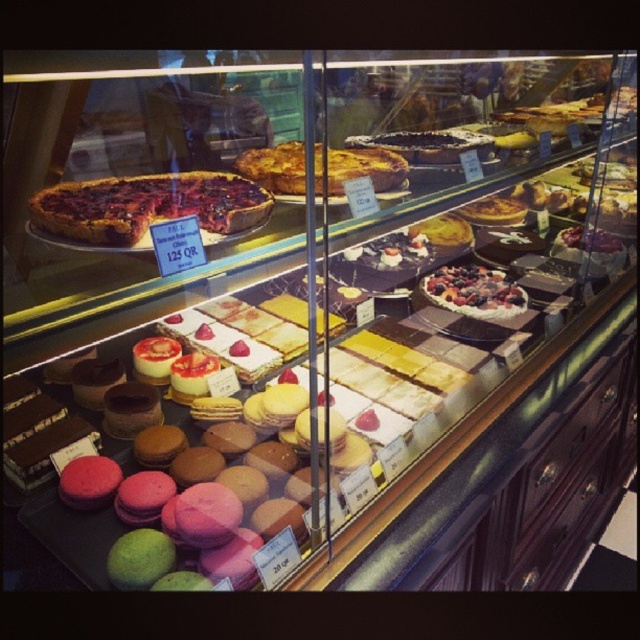
Is dark chocolate pie at upper left further to camera compared to berry-topped tart at center?

That is False.

Does dark chocolate pie at upper left come in front of berry-topped tart at center?

Yes.

Between point (264, 208) and point (454, 305), which one is positioned behind?

The point (454, 305) is more distant.

Identify the location of dark chocolate pie at upper left. (145, 205).

Based on the photo, is dark chocolate pie at upper left closer to camera compared to golden flaky pie at center?

→ That is True.

Between dark chocolate pie at upper left and golden flaky pie at center, which one appears on the left side from the viewer's perspective?

From the viewer's perspective, dark chocolate pie at upper left appears more on the left side.

The height and width of the screenshot is (640, 640). Find the location of `dark chocolate pie at upper left`. dark chocolate pie at upper left is located at coordinates (145, 205).

Can you confirm if golden flaky pie at center is positioned to the right of berry-topped tart at center?

No, golden flaky pie at center is not to the right of berry-topped tart at center.

Who is taller, golden flaky pie at center or berry-topped tart at center?

Standing taller between the two is golden flaky pie at center.

Does point (330, 186) come behind point (440, 305)?

That is False.

You are a GUI agent. You are given a task and a screenshot of the screen. Output one action in this format:
    pyautogui.click(x=<x>, y=<y>)
    Task: Click on the golden flaky pie at center
    This screenshot has width=640, height=640.
    Given the screenshot: What is the action you would take?
    pyautogui.click(x=364, y=168)